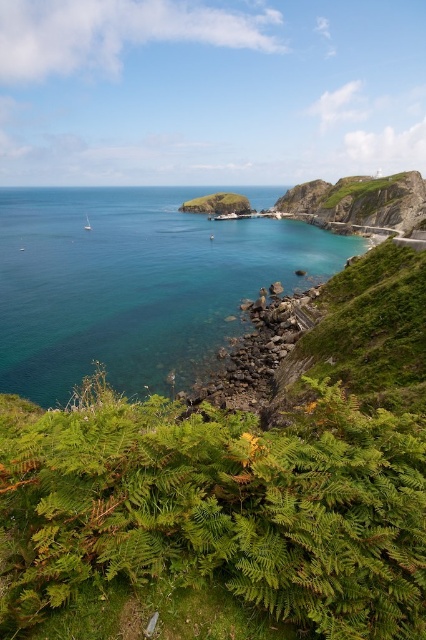
Question: Does green leafy ferns at lower center appear under white glossy boat at lower left?

Choices:
 (A) yes
 (B) no

Answer: (A)

Question: From the image, what is the correct spatial relationship of green grassy hill at center in relation to white glossy boat at lower left?

Choices:
 (A) below
 (B) above

Answer: (B)

Question: From the image, what is the correct spatial relationship of green leafy ferns at lower center in relation to green grassy hill at center?

Choices:
 (A) above
 (B) below

Answer: (B)

Question: Which object is positioned closest to the green leafy ferns at lower center?

Choices:
 (A) green grassy hillside at upper right
 (B) white glossy boat at lower left

Answer: (B)

Question: Which point is farther to the camera?

Choices:
 (A) (391, 216)
 (B) (344, 236)

Answer: (B)

Question: Estimate the real-world distances between objects in this image. Which object is closer to the green grassy hill at center?

Choices:
 (A) green grassy hillside at upper right
 (B) white glossy boat at lower left

Answer: (A)